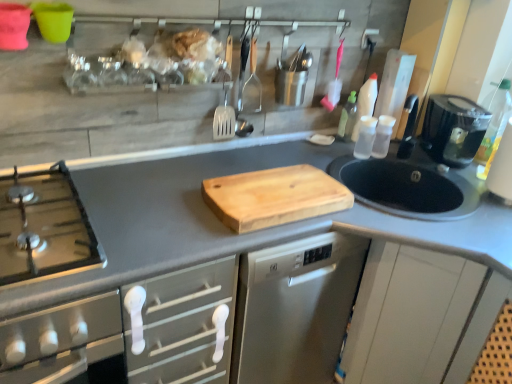
Question: Does black plastic coffee maker at right contain natural wood cutting board at center?

Choices:
 (A) yes
 (B) no

Answer: (B)

Question: Is black plastic coffee maker at right not within natural wood cutting board at center?

Choices:
 (A) yes
 (B) no

Answer: (A)

Question: From a real-world perspective, is black plastic coffee maker at right below natural wood cutting board at center?

Choices:
 (A) no
 (B) yes

Answer: (A)

Question: From the image's perspective, is black plastic coffee maker at right below natural wood cutting board at center?

Choices:
 (A) yes
 (B) no

Answer: (B)

Question: Considering the relative positions of black plastic coffee maker at right and natural wood cutting board at center in the image provided, is black plastic coffee maker at right to the right of natural wood cutting board at center from the viewer's perspective?

Choices:
 (A) no
 (B) yes

Answer: (B)

Question: Does black plastic coffee maker at right have a lesser height compared to natural wood cutting board at center?

Choices:
 (A) yes
 (B) no

Answer: (B)

Question: Is transparent plastic bottle at right, the first bottle positioned from the right, at the right side of transparent plastic bottle at upper right, which is the third bottle in right-to-left order?

Choices:
 (A) yes
 (B) no

Answer: (A)

Question: From a real-world perspective, does transparent plastic bottle at right, the third bottle viewed from the left, stand above transparent plastic bottle at upper right, which is the first bottle in left-to-right order?

Choices:
 (A) no
 (B) yes

Answer: (B)

Question: Is transparent plastic bottle at right, the third bottle viewed from the left, further to the viewer compared to transparent plastic bottle at upper right, which is the first bottle in left-to-right order?

Choices:
 (A) yes
 (B) no

Answer: (B)

Question: Is transparent plastic bottle at right, the first bottle positioned from the right, not close to transparent plastic bottle at upper right, which is the third bottle in right-to-left order?

Choices:
 (A) yes
 (B) no

Answer: (B)

Question: From a real-world perspective, is transparent plastic bottle at right, the first bottle positioned from the right, located beneath transparent plastic bottle at upper right, which is the third bottle in right-to-left order?

Choices:
 (A) yes
 (B) no

Answer: (B)

Question: Does transparent plastic bottle at right, the third bottle viewed from the left, have a greater width compared to transparent plastic bottle at upper right, which is the third bottle in right-to-left order?

Choices:
 (A) yes
 (B) no

Answer: (A)

Question: Are transparent plastic bottle at right, the first bottle positioned from the right, and transparent plastic bottles at right, the 2th bottle viewed from the right, far apart?

Choices:
 (A) no
 (B) yes

Answer: (A)